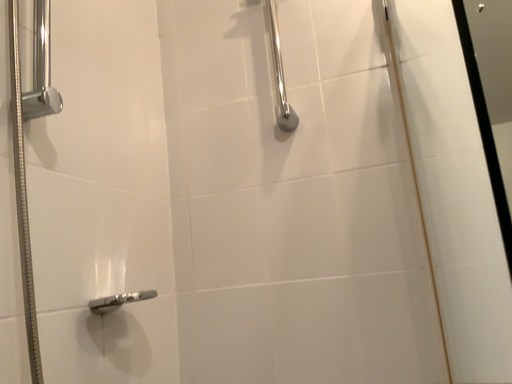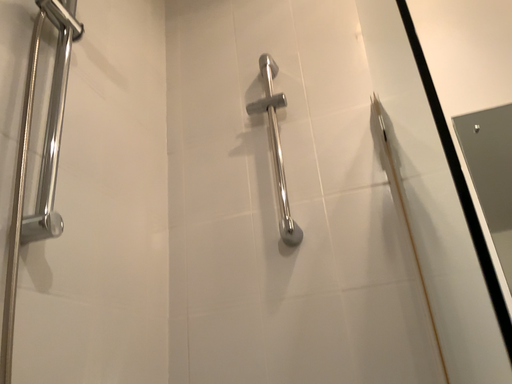
Question: How did the camera likely rotate when shooting the video?

Choices:
 (A) rotated downward
 (B) rotated upward

Answer: (B)